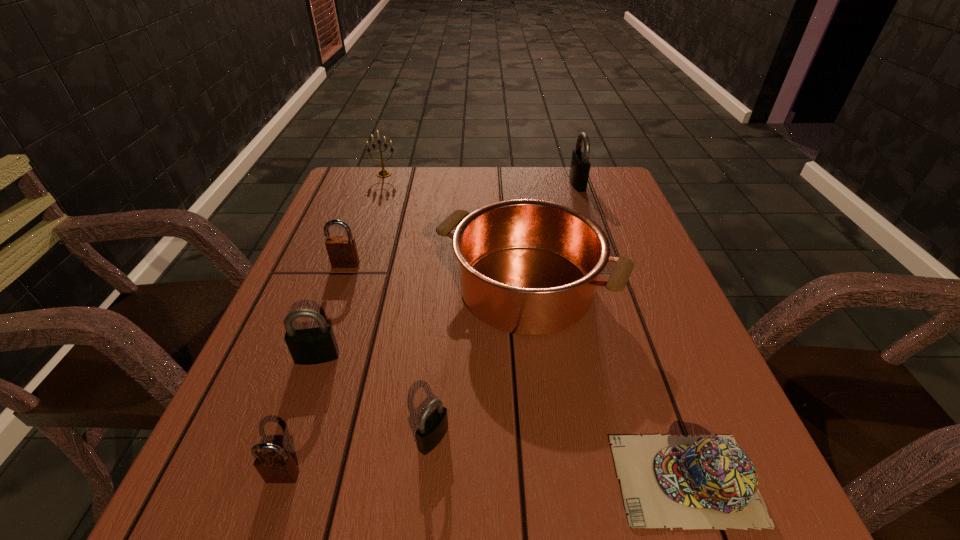
You are a GUI agent. You are given a task and a screenshot of the screen. Output one action in this format:
    pyautogui.click(x=<x>, y=<y>)
    Task: Click on the nearer brown padlock
    The width and height of the screenshot is (960, 540).
    Given the screenshot: What is the action you would take?
    pyautogui.click(x=274, y=467)

I want to click on the nearest padlock, so click(x=274, y=467).

This screenshot has height=540, width=960. What are the coordinates of `cap` in the screenshot? It's located at (700, 482).

Locate an element on the screen. The height and width of the screenshot is (540, 960). free space located 0.090m on the front of the rightmost black padlock is located at coordinates (586, 210).

Identify the location of vacant area located on the front of the candelabrum. (375, 201).

This screenshot has height=540, width=960. Identify the location of vacant area located 0.250m on the left of the saucepan. (320, 288).

The image size is (960, 540). I want to click on blank area located on the front-facing side of the farther brown padlock, so click(338, 286).

Identify the location of vacant area located on the front of the third nearest padlock. Image resolution: width=960 pixels, height=540 pixels. (302, 399).

Identify the location of free location located 0.090m on the right of the smallest black padlock. (506, 438).

Locate an element on the screen. The height and width of the screenshot is (540, 960). free region located 0.050m on the front-facing side of the nearest padlock is located at coordinates (268, 521).